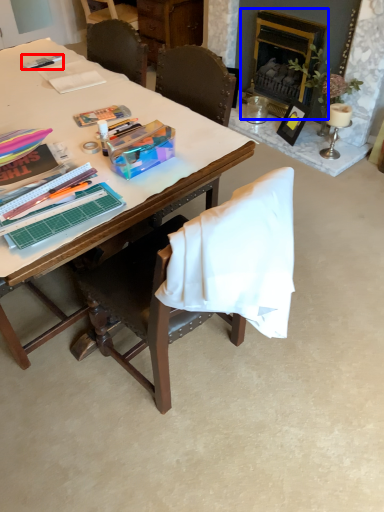
Question: Which object appears farthest to the camera in this image, pen (highlighted by a red box) or fireplace (highlighted by a blue box)?

Choices:
 (A) pen
 (B) fireplace

Answer: (B)